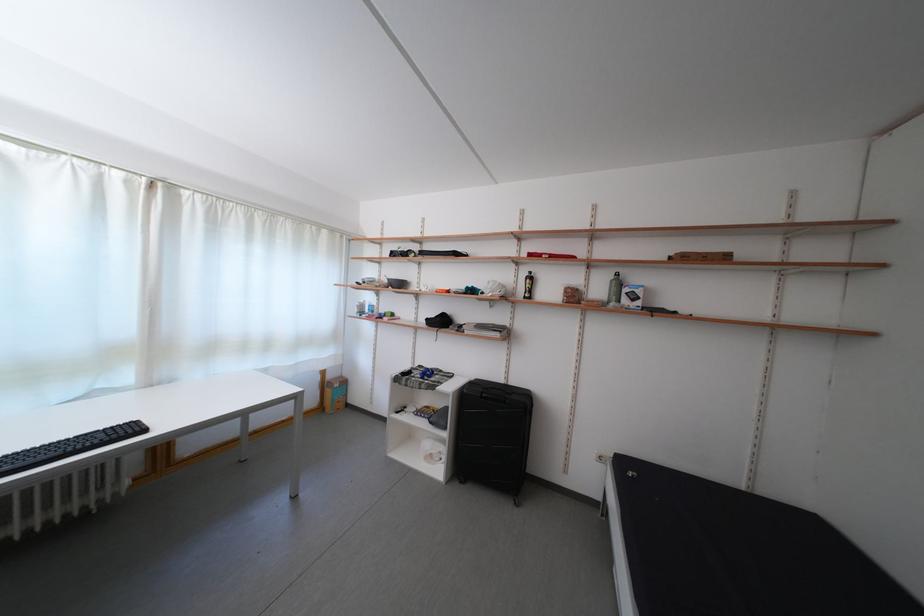
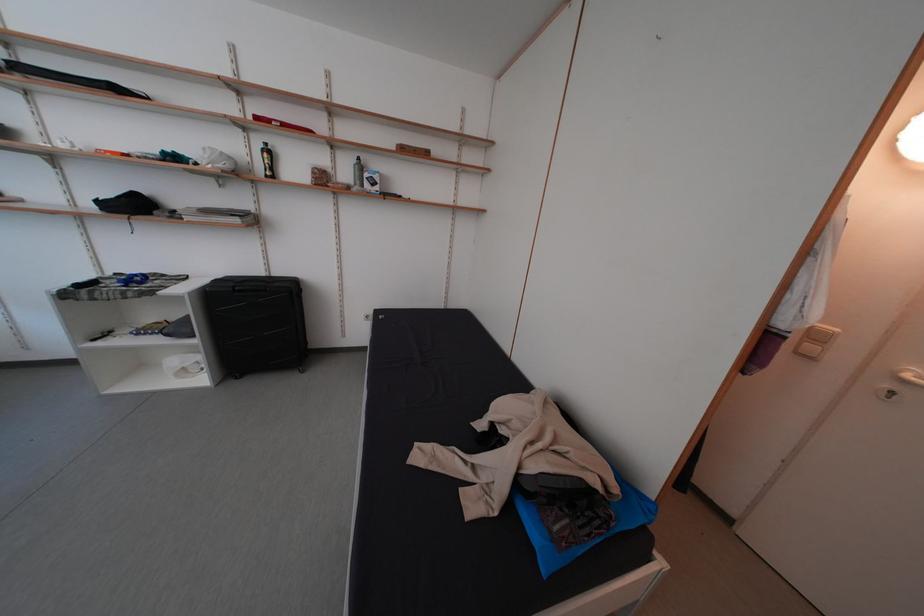
The point at (x=506, y=383) is marked in the first image. Where is the corresponding point in the second image?

(265, 276)